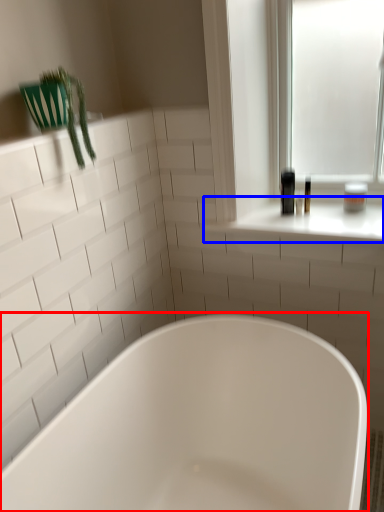
Question: Which object appears closest to the camera in this image, bathtub (highlighted by a red box) or window sill (highlighted by a blue box)?

Choices:
 (A) bathtub
 (B) window sill

Answer: (A)